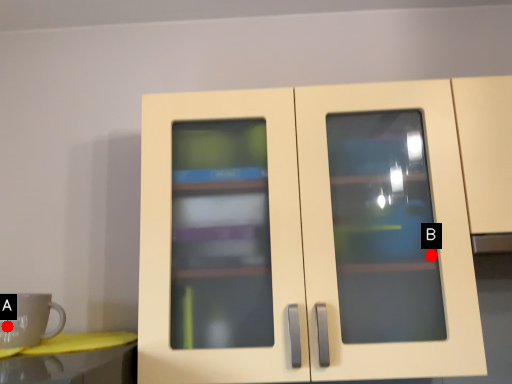
Question: Two points are circled on the image, labeled by A and B beside each circle. Which point is closer to the camera?

Choices:
 (A) A is closer
 (B) B is closer

Answer: (A)